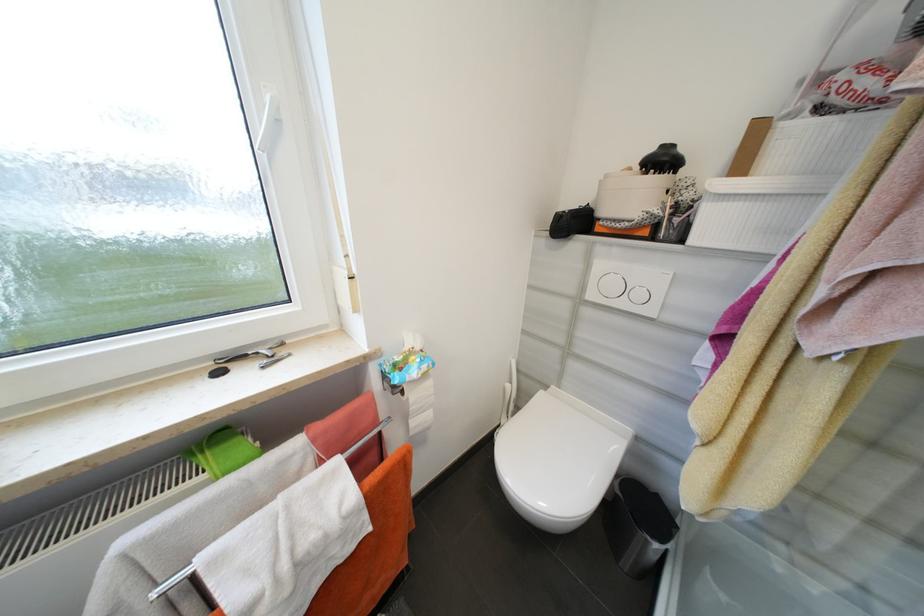
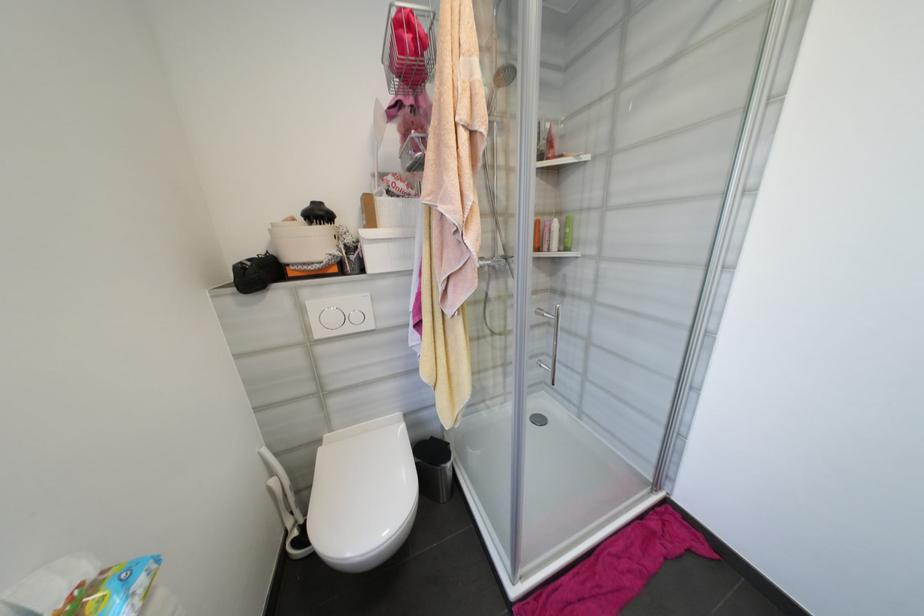
Question: I am providing you with two images of the same scene from different viewpoints. Which of the following objects are not visible in image2?

Choices:
 (A) shower head
 (B) orange bottle
 (C) small flush button
 (D) none of these

Answer: (D)